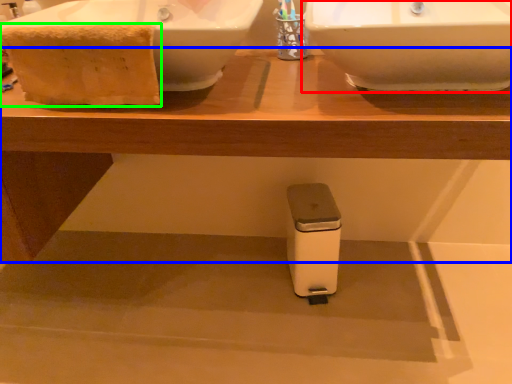
Question: Which object is the closest to the sink (highlighted by a red box)? Choose among these: table (highlighted by a blue box) or material (highlighted by a green box).

Choices:
 (A) table
 (B) material

Answer: (A)